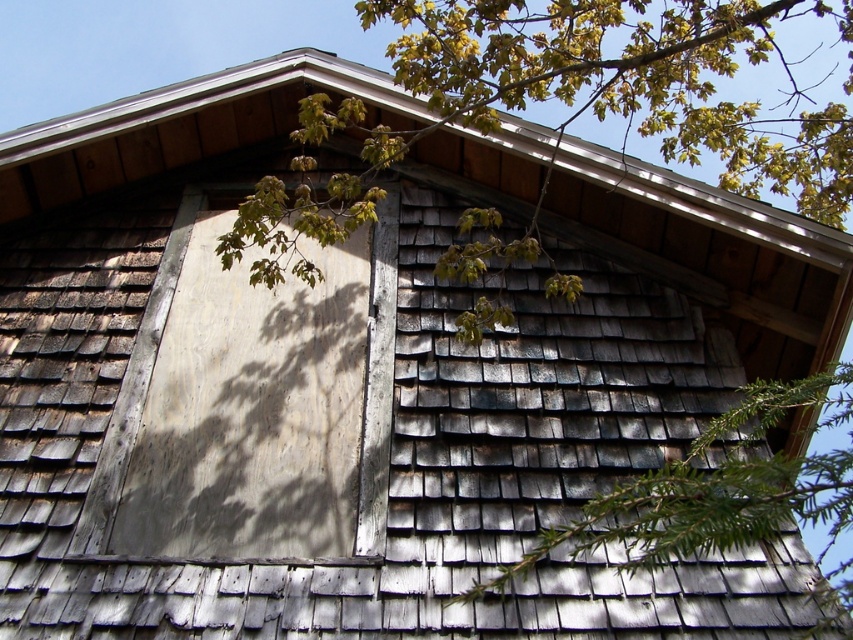
Question: Which point is closer to the camera taking this photo?

Choices:
 (A) (682, 476)
 (B) (239, 316)

Answer: (A)

Question: Can you confirm if white wood board at center is positioned to the left of green textured pine branch at center?

Choices:
 (A) no
 (B) yes

Answer: (B)

Question: Is white wood board at center smaller than green textured pine branch at center?

Choices:
 (A) yes
 (B) no

Answer: (B)

Question: Which object appears farthest from the camera in this image?

Choices:
 (A) white wood board at center
 (B) green textured pine branch at center

Answer: (A)

Question: Is white wood board at center below green textured pine branch at center?

Choices:
 (A) no
 (B) yes

Answer: (A)